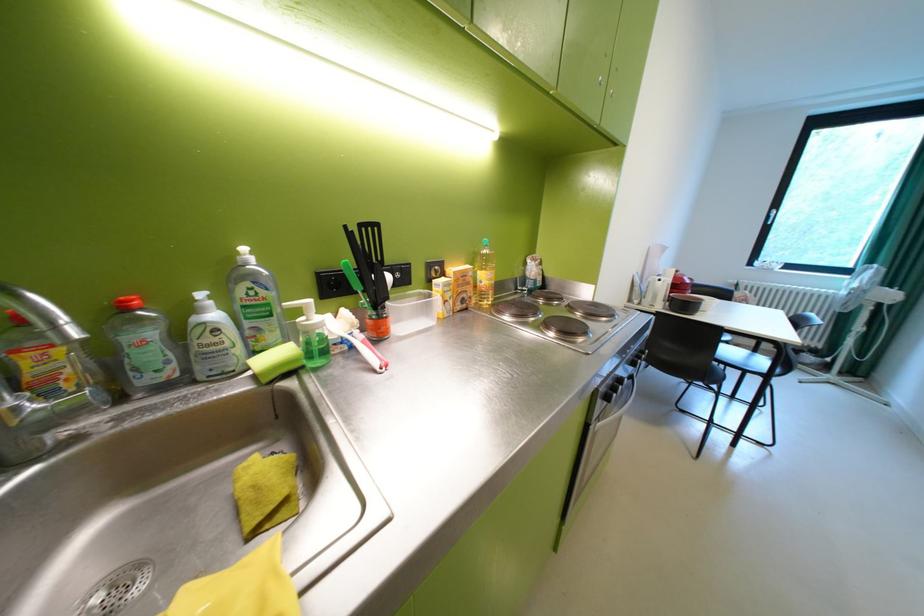
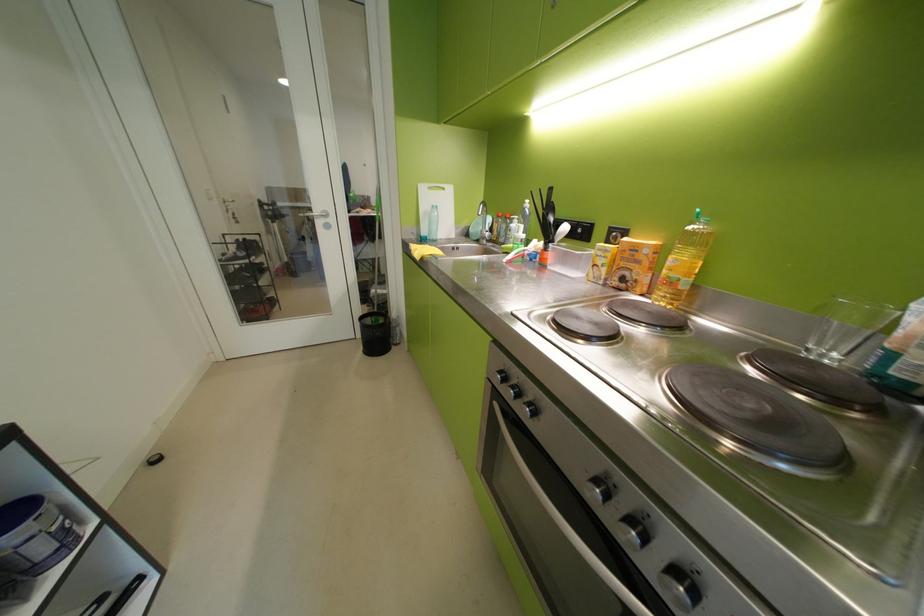
In the second image, find the point that corresponds to [402,321] in the first image.

(561, 256)